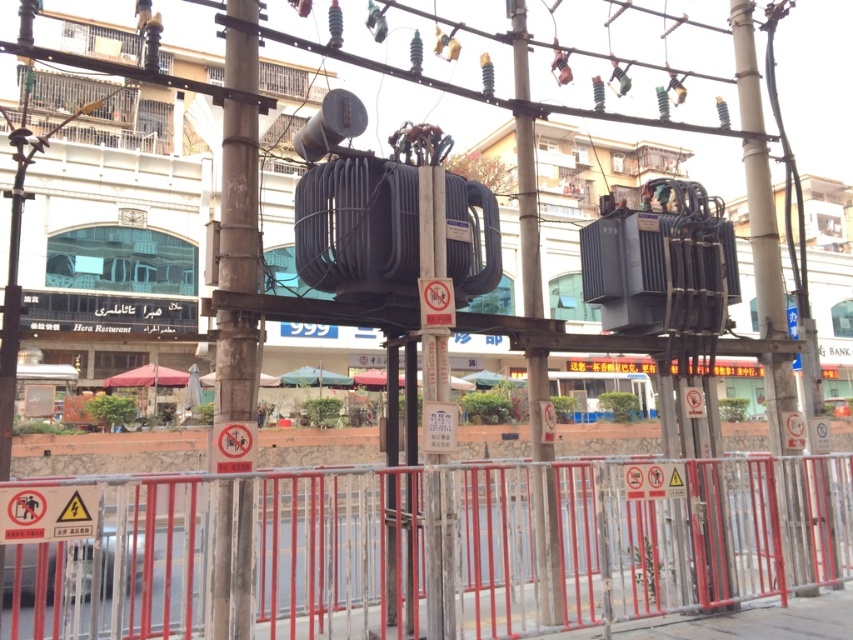
Can you confirm if rusty metal pole at center is positioned above metallic gray transformer at center?

Result: Actually, rusty metal pole at center is below metallic gray transformer at center.

Between point (252, 193) and point (550, 556), which one is positioned in front?

Point (252, 193)

The image size is (853, 640). I want to click on rusty metal pole at center, so click(x=239, y=198).

Does point (308, 552) come farther from viewer compared to point (219, 396)?

No.

Image resolution: width=853 pixels, height=640 pixels. What are the coordinates of `metallic silver fence at lower center` in the screenshot? It's located at (538, 541).

Consider the image. Which is more to the right, smooth beige pole at right or metallic gray transformer at center?

From the viewer's perspective, smooth beige pole at right appears more on the right side.

Who is more distant from viewer, [750,80] or [526,65]?

Positioned behind is point [750,80].

What are the coordinates of `smooth beige pole at right` in the screenshot? It's located at (757, 177).